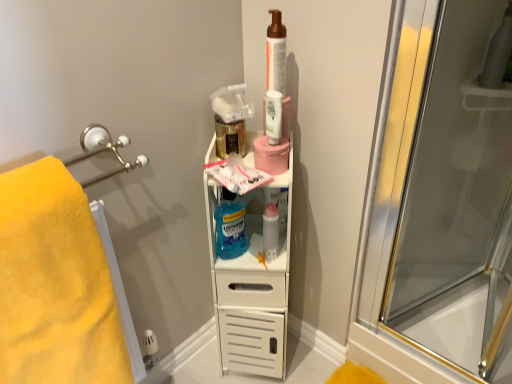
Where is `empty space that is ontop of yellow soft towel at left (from a real-world perspective)`? The height and width of the screenshot is (384, 512). empty space that is ontop of yellow soft towel at left (from a real-world perspective) is located at coordinates (30, 179).